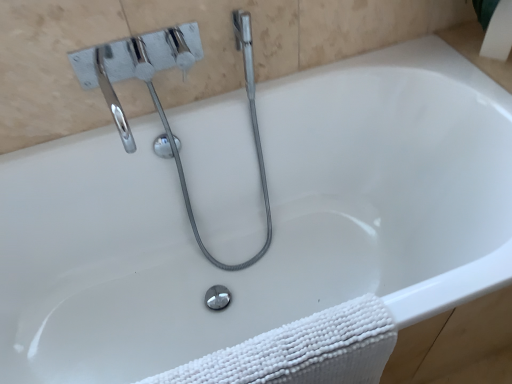
Question: Does point (378, 309) appear closer or farther from the camera than point (109, 64)?

Choices:
 (A) closer
 (B) farther

Answer: (A)

Question: From a real-world perspective, is white textured towel at lower right positioned above or below chrome/metallic faucet at upper left?

Choices:
 (A) above
 (B) below

Answer: (B)

Question: Considering the positions of white textured towel at lower right and chrome/metallic faucet at upper left in the image, is white textured towel at lower right bigger or smaller than chrome/metallic faucet at upper left?

Choices:
 (A) big
 (B) small

Answer: (B)

Question: Based on their positions, is chrome/metallic faucet at upper left located to the left or right of white textured towel at lower right?

Choices:
 (A) left
 (B) right

Answer: (A)

Question: Does point (174, 38) appear closer or farther from the camera than point (201, 360)?

Choices:
 (A) closer
 (B) farther

Answer: (B)

Question: From a real-world perspective, relative to white textured towel at lower right, is chrome/metallic faucet at upper left vertically above or below?

Choices:
 (A) above
 (B) below

Answer: (A)

Question: Looking at their shapes, would you say chrome/metallic faucet at upper left is wider or thinner than white textured towel at lower right?

Choices:
 (A) thin
 (B) wide

Answer: (B)